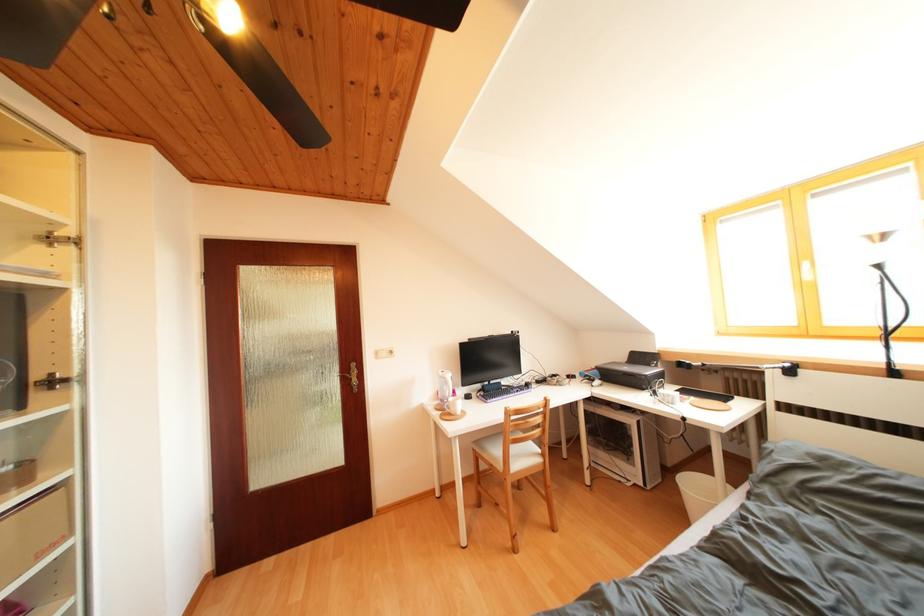
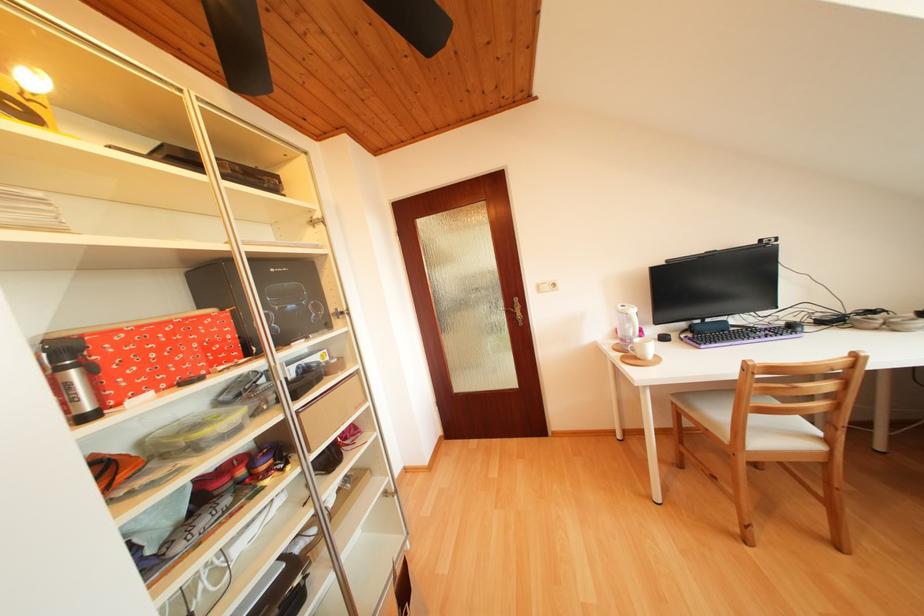
In the second image, find the point that corresponds to pixel 520 338 in the first image.

(769, 246)